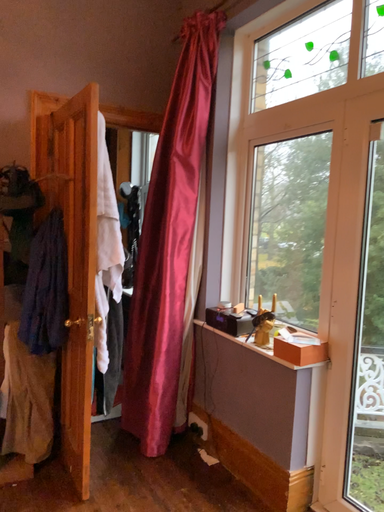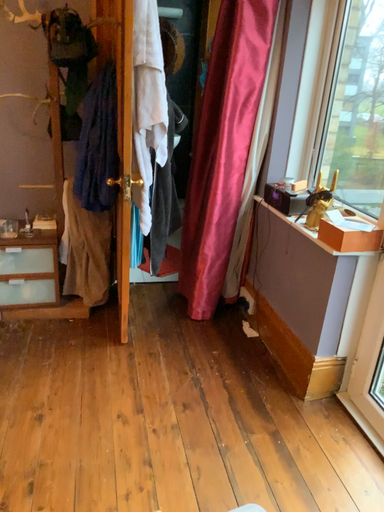
Question: How did the camera likely rotate when shooting the video?

Choices:
 (A) rotated downward
 (B) rotated upward

Answer: (A)